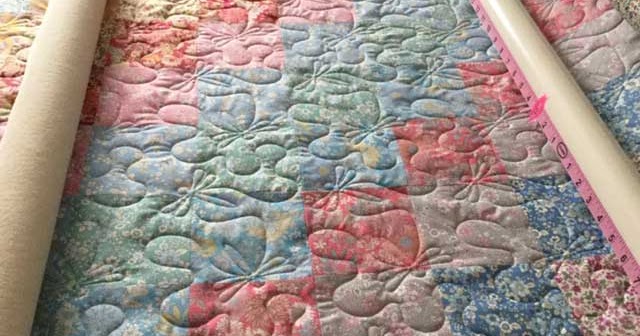
In order to click on cream colored cylinder on the left side of quilt in this screenshot , I will do `click(49, 157)`.